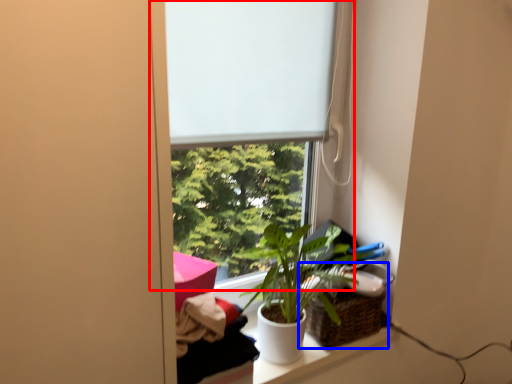
Question: Among these objects, which one is farthest to the camera, window (highlighted by a red box) or basket (highlighted by a blue box)?

Choices:
 (A) window
 (B) basket

Answer: (B)